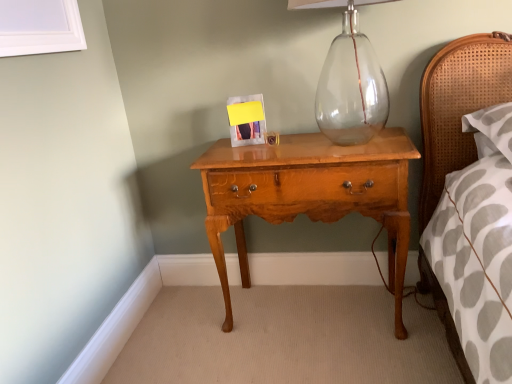
The width and height of the screenshot is (512, 384). Find the location of `vacant space situated on the left part of light brown wood nightstand at center`. vacant space situated on the left part of light brown wood nightstand at center is located at coordinates (191, 332).